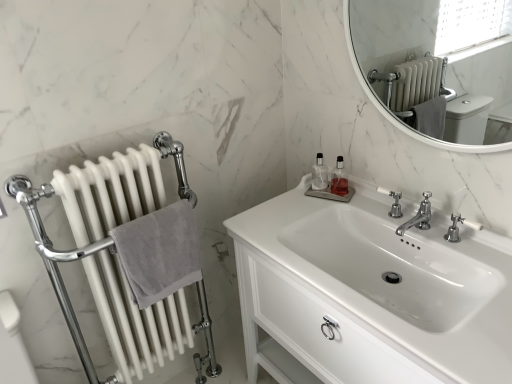
Question: Should I look upward or downward to see white glossy sink at center?

Choices:
 (A) down
 (B) up

Answer: (A)

Question: Does white matte radiator at left have a larger size compared to gray cotton towel at left?

Choices:
 (A) no
 (B) yes

Answer: (B)

Question: Is white matte radiator at left not near gray cotton towel at left?

Choices:
 (A) no
 (B) yes

Answer: (A)

Question: Is white matte radiator at left facing towards gray cotton towel at left?

Choices:
 (A) yes
 (B) no

Answer: (A)

Question: Is the depth of white matte radiator at left less than that of gray cotton towel at left?

Choices:
 (A) no
 (B) yes

Answer: (B)

Question: Does white matte radiator at left appear on the left side of gray cotton towel at left?

Choices:
 (A) no
 (B) yes

Answer: (B)

Question: From the image's perspective, is white matte radiator at left located above gray cotton towel at left?

Choices:
 (A) yes
 (B) no

Answer: (B)

Question: Does white marble mirror at upper right have a greater width compared to gray cotton towel at left?

Choices:
 (A) no
 (B) yes

Answer: (A)

Question: Can you confirm if white marble mirror at upper right is positioned to the right of gray cotton towel at left?

Choices:
 (A) no
 (B) yes

Answer: (B)

Question: Considering the relative sizes of white marble mirror at upper right and gray cotton towel at left in the image provided, is white marble mirror at upper right bigger than gray cotton towel at left?

Choices:
 (A) no
 (B) yes

Answer: (B)

Question: Is white marble mirror at upper right oriented away from gray cotton towel at left?

Choices:
 (A) no
 (B) yes

Answer: (A)

Question: Does white marble mirror at upper right have a greater height compared to gray cotton towel at left?

Choices:
 (A) yes
 (B) no

Answer: (A)

Question: Does white marble mirror at upper right have a smaller size compared to gray cotton towel at left?

Choices:
 (A) no
 (B) yes

Answer: (A)

Question: Can you see white glossy sink at center touching polished chrome faucet at center, which ranks as the 1th tap in left-to-right order?

Choices:
 (A) yes
 (B) no

Answer: (B)